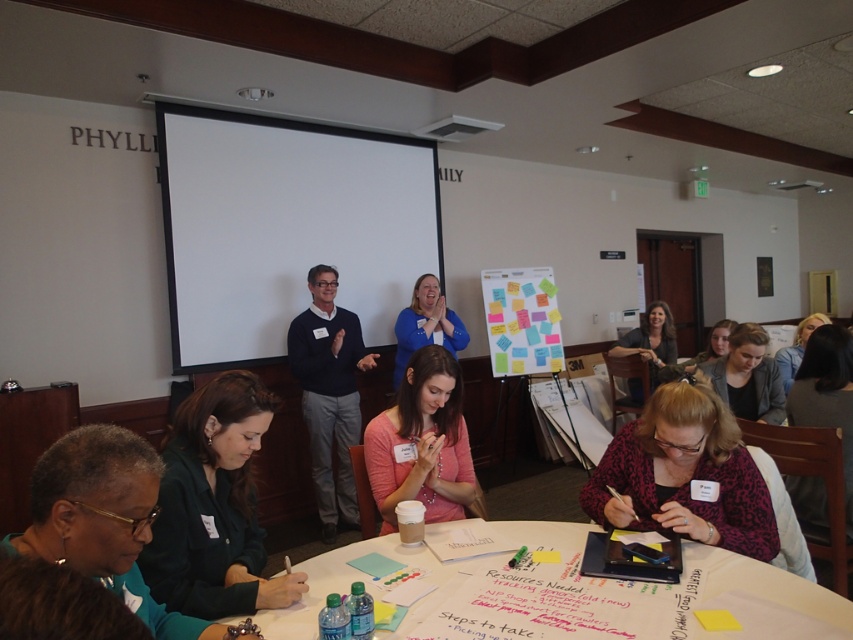
You are an event planner who needs to set up a projector for the next presentation. The projector can only project onto surfaces that are at least 2 meters wide. Given the white matte projection screen at upper center and the pink matte shirt at center, which object is suitable for projecting the presentation onto?

The white matte projection screen at upper center is suitable for projecting the presentation onto because it has a larger size compared to the pink matte shirt at center, which is too small for the projector.

You are standing at the entrance of the conference room and want to present your slides using the white matte projection screen at upper center. To do so, you need to position yourself in front of the screen but not blocking the projector. Based on the screen location, where should you stand relative to the screen?

The white matte projection screen at upper center is located at point (285, 227), so you should stand to the side of the screen to avoid blocking the projector.